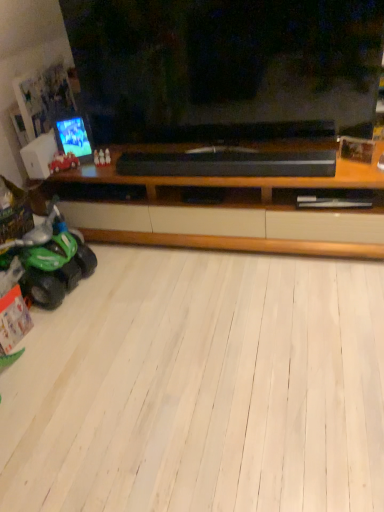
The height and width of the screenshot is (512, 384). Identify the location of vacant area that is in front of green plastic toy car at lower left, which appears as the 2th land vehicle when viewed from the top. (59, 334).